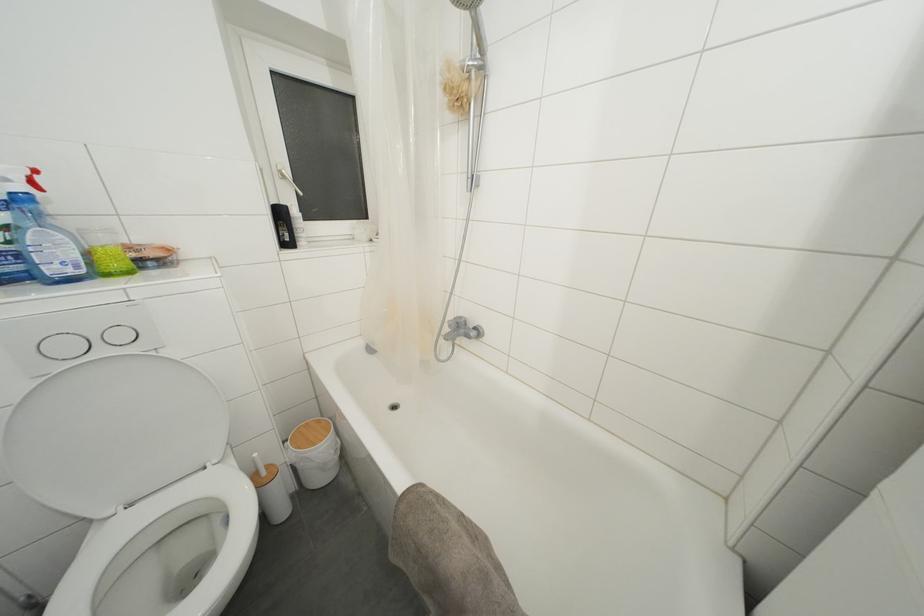
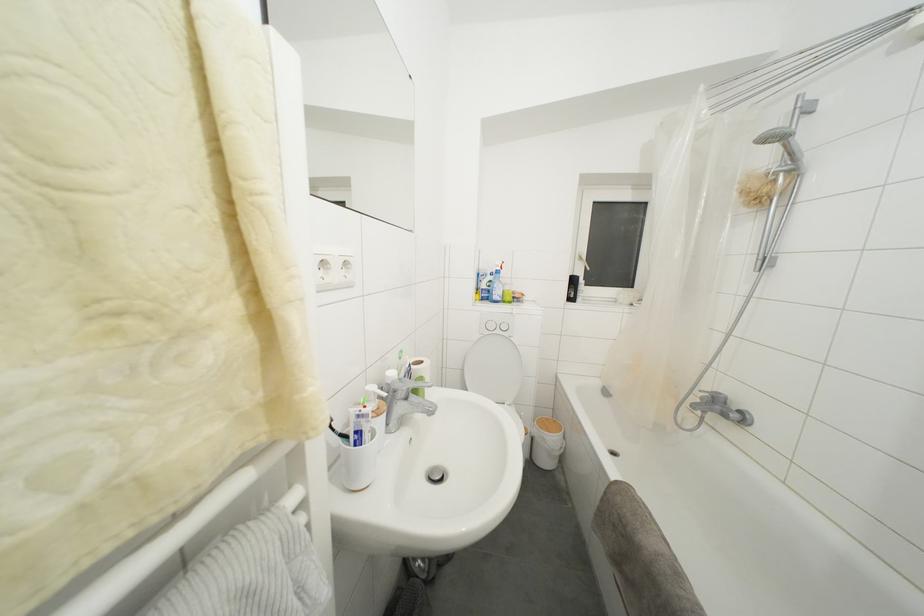
Locate, in the second image, the point that corresponds to pixel 310 429 in the first image.

(552, 424)